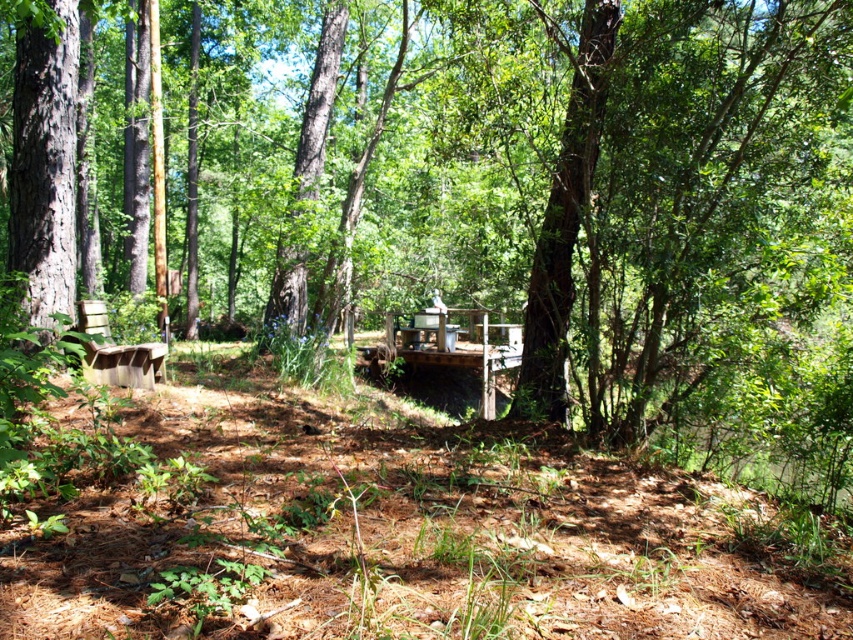
Question: Can you confirm if wooden picnic table at center is wider than wooden park bench at left?

Choices:
 (A) no
 (B) yes

Answer: (B)

Question: Among these points, which one is farthest from the camera?

Choices:
 (A) (125, 355)
 (B) (422, 320)

Answer: (B)

Question: Does wooden picnic table at center appear on the left side of wooden park bench at left?

Choices:
 (A) no
 (B) yes

Answer: (A)

Question: Which point appears farthest from the camera in this image?

Choices:
 (A) (473, 324)
 (B) (82, 301)

Answer: (A)

Question: Does wooden picnic table at center come behind wooden park bench at left?

Choices:
 (A) yes
 (B) no

Answer: (A)